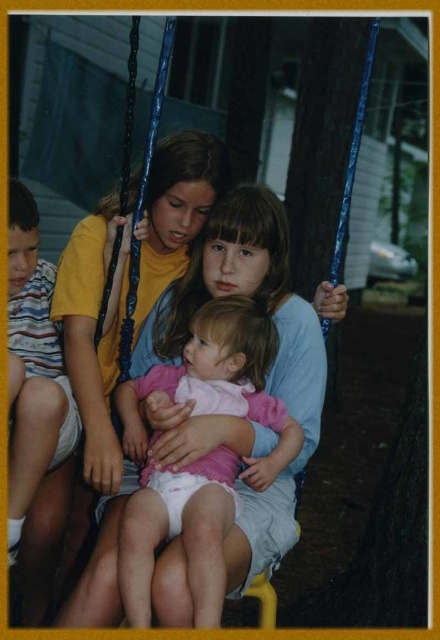
Question: Can you confirm if matte blue swing at center is bigger than matte pink dress at center?

Choices:
 (A) no
 (B) yes

Answer: (B)

Question: Can you confirm if matte pink dress at center is positioned to the right of striped cotton shirt at left?

Choices:
 (A) yes
 (B) no

Answer: (A)

Question: Which point is farther to the camera?

Choices:
 (A) matte pink dress at center
 (B) striped cotton shirt at left
 (C) matte blue swing at center

Answer: (B)

Question: Can you confirm if matte blue swing at center is positioned below matte pink dress at center?

Choices:
 (A) yes
 (B) no

Answer: (B)

Question: Based on their relative distances, which object is farther from the matte blue swing at center?

Choices:
 (A) striped cotton shirt at left
 (B) matte pink dress at center

Answer: (A)

Question: Which of the following is the farthest from the observer?

Choices:
 (A) striped cotton shirt at left
 (B) matte pink dress at center
 (C) matte blue swing at center

Answer: (A)